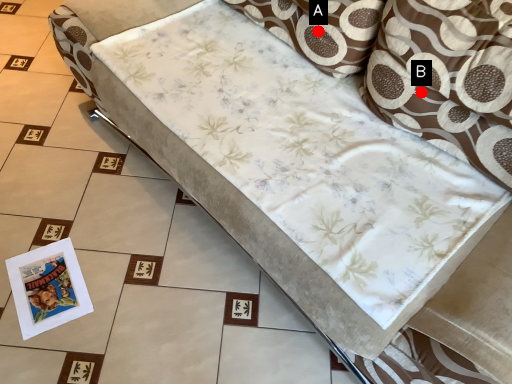
Question: Two points are circled on the image, labeled by A and B beside each circle. Which point appears farthest from the camera in this image?

Choices:
 (A) A is further
 (B) B is further

Answer: (A)